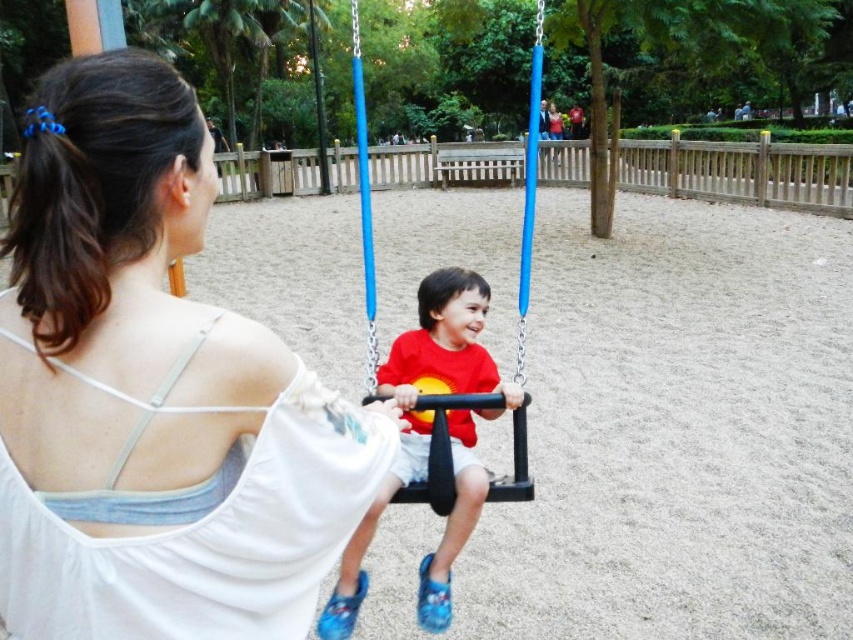
You are standing at the playground and see the white fabric at center and the matte plastic swing at center. Which object is nearer to you?

The white fabric at center is closer to the viewer than the matte plastic swing at center.

You are standing at the point labeled as point (152, 392) in the playground image. What object is directly in front of you?

The point (152, 392) corresponds to the white fabric at center, so the white fabric at center is directly in front of you.

You are standing at the point marked as point (152, 392). What is located directly in front of you?

The white fabric at center is located directly in front of point (152, 392).